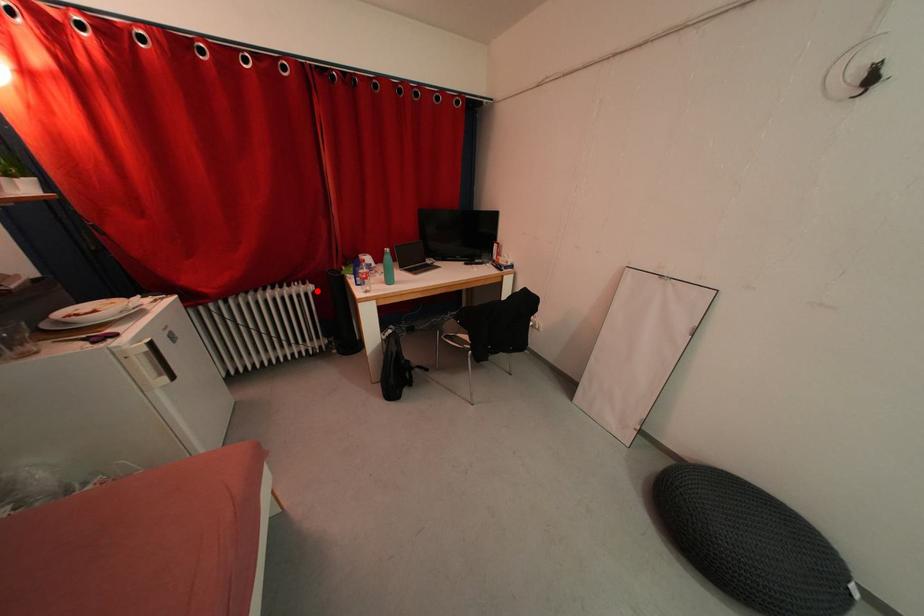
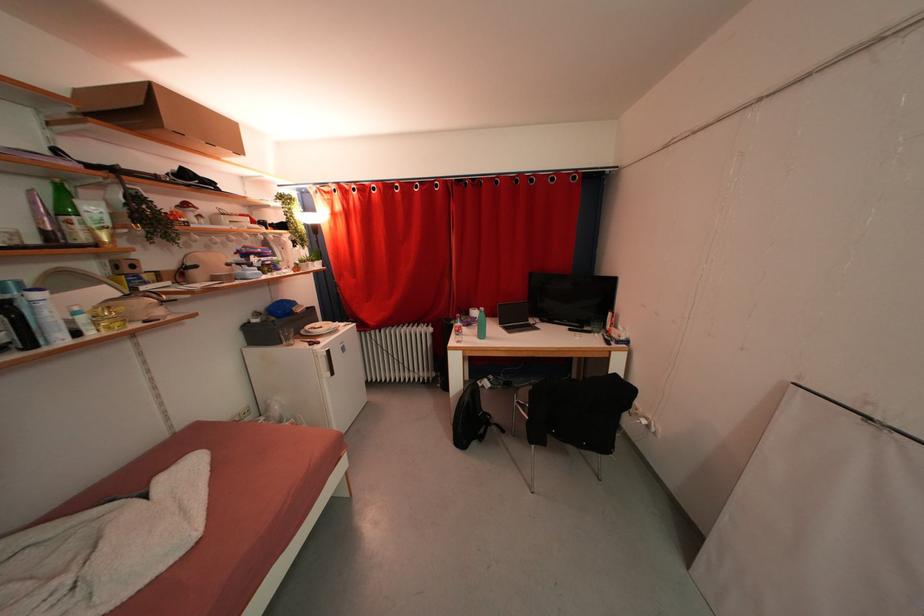
Where in the second image is the point corresponding to the highlighted location from the first image?

(436, 333)